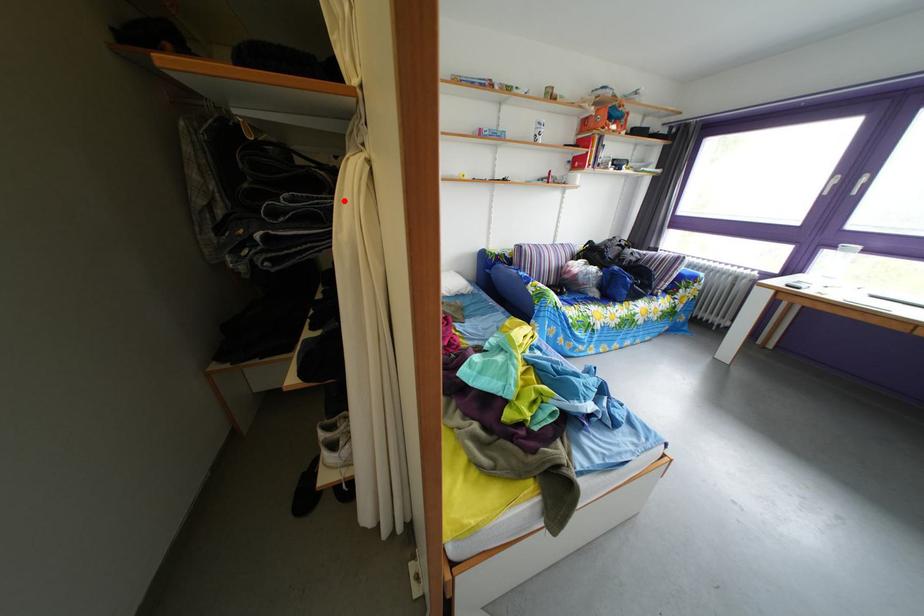
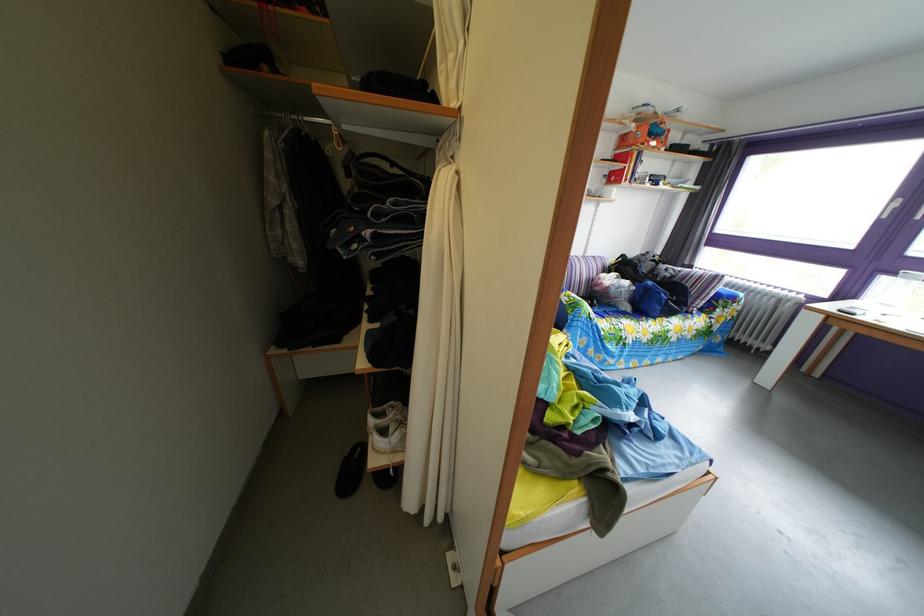
Find the pixel in the second image that matches the highlighted location in the first image.

(438, 207)